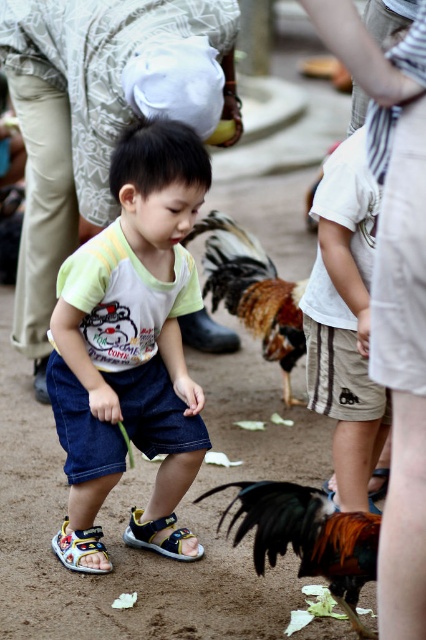
In the scene shown: You are a parent trying to pick the right sandal for your child. You see the blue fabric sandal at lower center and the multicolored fabric sandal at lower left. Which sandal is bigger?

The blue fabric sandal at lower center is bigger than the multicolored fabric sandal at lower left.

Where is the denim shorts at center located in the image?

The denim shorts at center is located at point (134, 337).